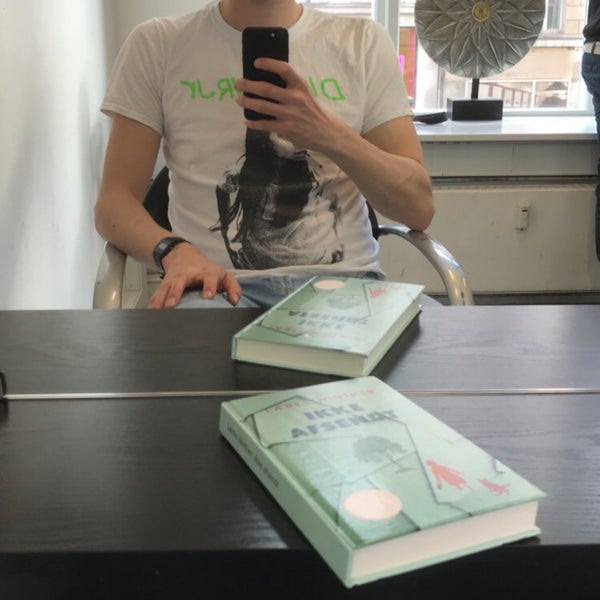
The width and height of the screenshot is (600, 600). I want to click on arm rest, so click(418, 242), click(113, 264), click(435, 250), click(389, 227).